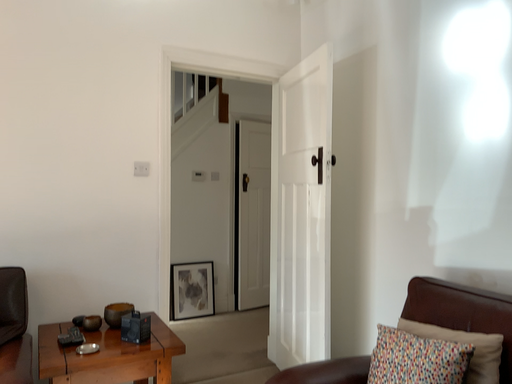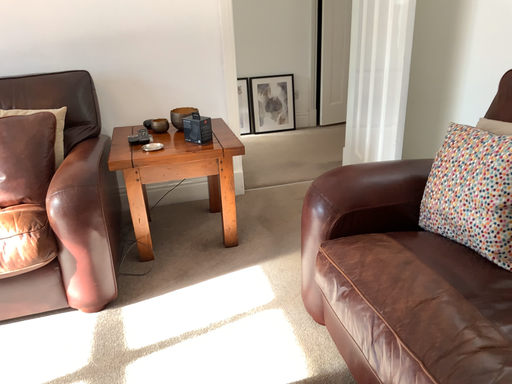
Question: Which way did the camera rotate in the video?

Choices:
 (A) rotated upward
 (B) rotated downward

Answer: (B)